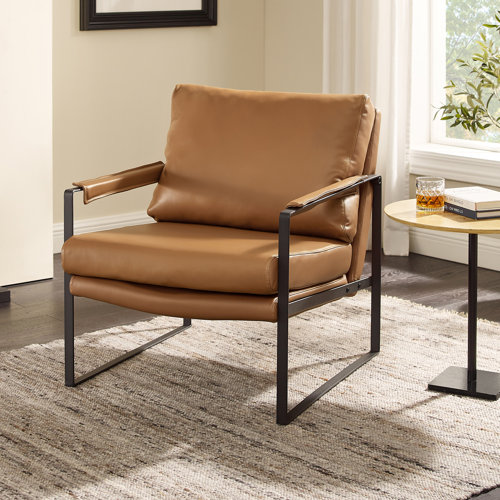
Image resolution: width=500 pixels, height=500 pixels. I want to click on pleather arm rests, so click(x=122, y=179), click(x=324, y=191).